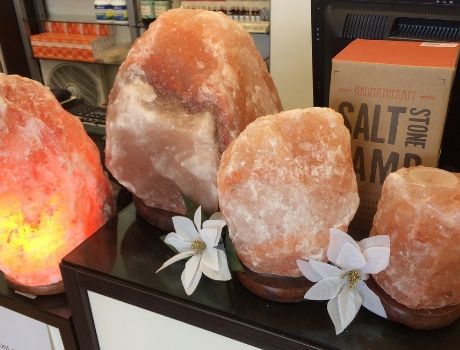
The width and height of the screenshot is (460, 350). Identify the location of cardboard box. (411, 121).